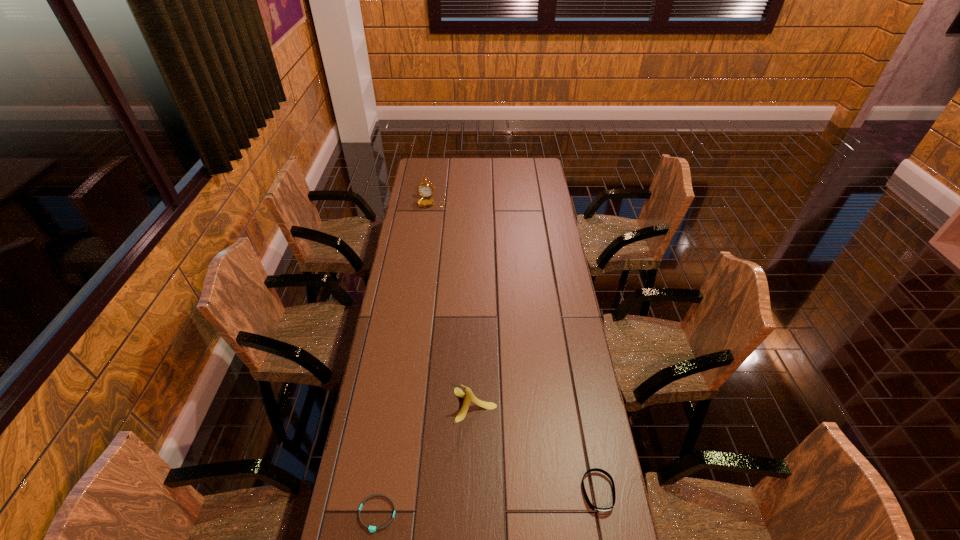
What are the coordinates of `wristband situated at the left edge` in the screenshot? It's located at click(x=372, y=529).

Locate an element on the screen. This screenshot has width=960, height=540. object situated at the right edge is located at coordinates (599, 510).

Where is `free space at the far edge of the desktop`? This screenshot has width=960, height=540. free space at the far edge of the desktop is located at coordinates (499, 168).

In order to click on vacant space at the left edge in this screenshot , I will do click(x=390, y=403).

Image resolution: width=960 pixels, height=540 pixels. In the image, there is a desktop. In order to click on vacant space at the right edge in this screenshot , I will do `click(614, 509)`.

The height and width of the screenshot is (540, 960). I want to click on vacant space that's between the right wristband and the shorter wristband, so click(x=488, y=503).

Identify the location of vacant area that lies between the left wristband and the taller wristband. [488, 503].

Find the location of a particular element. empty space between the shorter wristband and the rightmost object is located at coordinates (488, 503).

You are a GUI agent. You are given a task and a screenshot of the screen. Output one action in this format:
    pyautogui.click(x=<x>, y=<y>)
    Task: Click on the unoccupied position between the farthest object and the right wristband
    Image resolution: width=960 pixels, height=540 pixels.
    Given the screenshot: What is the action you would take?
    pyautogui.click(x=515, y=347)

Locate an element on the screen. The height and width of the screenshot is (540, 960). free space that is in between the farthest object and the second object from right to left is located at coordinates (453, 303).